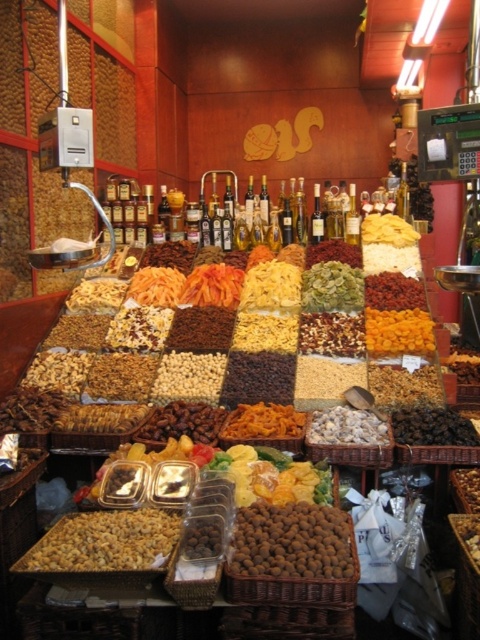
You are a customer at the market stall and want to grab both the brown textured nuts at lower right and the dark brown dried fruit at center. Since you have limited space in your bag, which item should you choose to take if you need to prioritize the taller one?

The dark brown dried fruit at center is taller than the brown textured nuts at lower right, so you should prioritize taking the dark brown dried fruit at center.

You are a customer at the market stall and want to pick up the brown textured nuts at lower right and the dark brown dried fruit at center. Which one can you reach without moving your current position?

The brown textured nuts at lower right is closer to you, so you can reach it without moving, but the dark brown dried fruit at center is further away and may require moving closer.

In the scene shown: You are standing in front of a market stall with dried fruits and nuts arranged in square baskets and trays. There is a specific point marked at coordinates point (464, 486). If you want to reach this point without moving your feet, can you comfortably extend your hand to touch it?

The point (464, 486) is 2.74 meters away from the viewer. Since the average human arm length is about 0.7 meters, you cannot comfortably extend your hand to touch it without moving your feet.